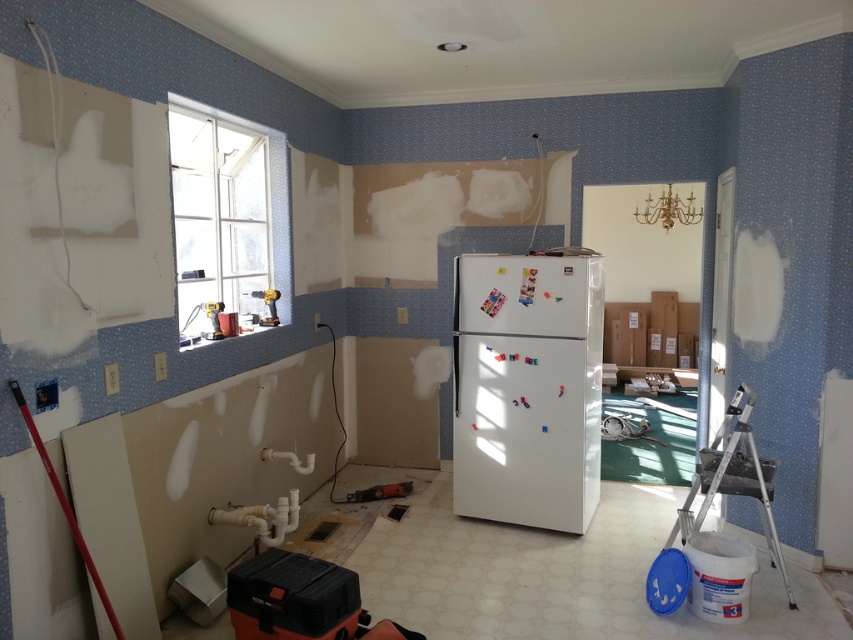
You are a GUI agent. You are given a task and a screenshot of the screen. Output one action in this format:
    pyautogui.click(x=<x>, y=<y>)
    Task: Click on the silver metallic ladder at right
    
    Given the screenshot: What is the action you would take?
    pyautogui.click(x=734, y=477)

Is silver metallic ladder at right smaller than metallic orange power tool at center?

Actually, silver metallic ladder at right might be larger than metallic orange power tool at center.

Locate an element on the screen. This screenshot has width=853, height=640. silver metallic ladder at right is located at coordinates (734, 477).

Does point (593, 362) come closer to viewer compared to point (735, 429)?

No, it is behind (735, 429).

Is white matte refrigerator at center taller than silver metallic ladder at right?

Indeed, white matte refrigerator at center has a greater height compared to silver metallic ladder at right.

Where is `white matte refrigerator at center`? This screenshot has height=640, width=853. white matte refrigerator at center is located at coordinates point(527,388).

Looking at this image, is white matte refrigerator at center below metallic orange power tool at center?

Incorrect, white matte refrigerator at center is not positioned below metallic orange power tool at center.

Can you confirm if white matte refrigerator at center is shorter than metallic orange power tool at center?

No, white matte refrigerator at center is not shorter than metallic orange power tool at center.

This screenshot has width=853, height=640. I want to click on white matte refrigerator at center, so click(527, 388).

The width and height of the screenshot is (853, 640). I want to click on white matte refrigerator at center, so click(x=527, y=388).